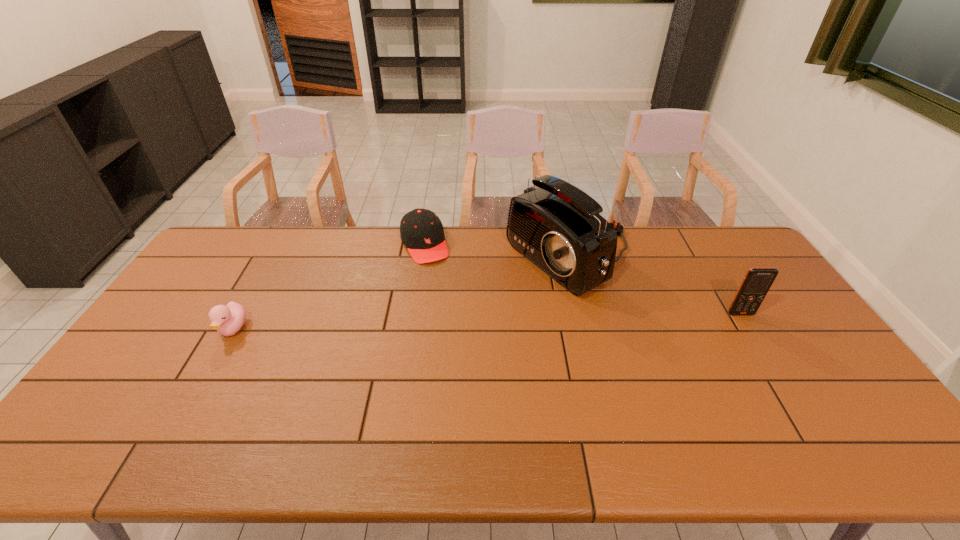
Identify the location of vacant position located 0.330m on the front-facing side of the third object from right to left. The width and height of the screenshot is (960, 540). (463, 330).

At what (x,y) coordinates should I click in order to perform the action: click on blank space located on the front-facing side of the radio receiver. Please return your answer as a coordinate pair (x, y). This screenshot has height=540, width=960. Looking at the image, I should click on (455, 317).

Image resolution: width=960 pixels, height=540 pixels. What are the coordinates of `blank area located 0.180m on the front-facing side of the radio receiver` in the screenshot? It's located at (476, 306).

Identify the location of free spot located on the front-facing side of the radio receiver. The height and width of the screenshot is (540, 960). (423, 333).

The width and height of the screenshot is (960, 540). I want to click on cap located at the far edge, so click(421, 231).

Where is `radio receiver located in the far edge section of the desktop`? This screenshot has width=960, height=540. radio receiver located in the far edge section of the desktop is located at coordinates (557, 226).

Find the location of `object that is at the right edge`. object that is at the right edge is located at coordinates (757, 281).

Locate an element on the screen. The width and height of the screenshot is (960, 540). vacant space at the far edge is located at coordinates (697, 245).

Locate an element on the screen. This screenshot has height=540, width=960. free spot at the near edge of the desktop is located at coordinates (398, 403).

This screenshot has width=960, height=540. What are the coordinates of `blank space at the left edge of the desktop` in the screenshot? It's located at (162, 339).